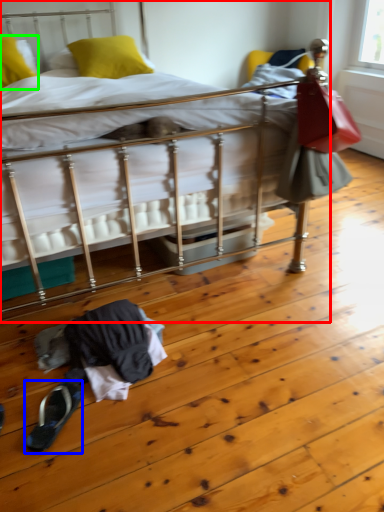
Question: Which object is the closest to the bed (highlighted by a red box)? Choose among these: footwear (highlighted by a blue box) or pillow (highlighted by a green box).

Choices:
 (A) footwear
 (B) pillow

Answer: (B)